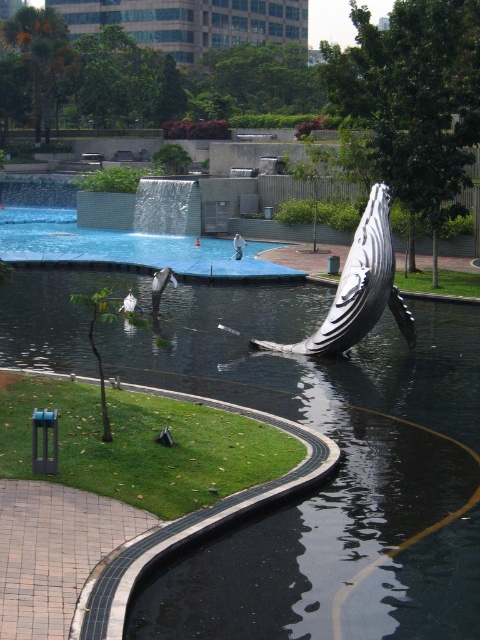
Question: Which object is positioned closest to the blue glossy pond at center?

Choices:
 (A) zebra-striped sculpture at center
 (B) black glossy pool at center

Answer: (B)

Question: Which of the following is the closest to the observer?

Choices:
 (A) zebra-striped sculpture at center
 (B) blue glossy pond at center
 (C) black glossy pool at center

Answer: (C)

Question: Which point appears closest to the camera in this image?

Choices:
 (A) (216, 253)
 (B) (367, 305)

Answer: (B)

Question: Can you confirm if blue glossy pond at center is positioned below zebra-striped sculpture at center?

Choices:
 (A) yes
 (B) no

Answer: (B)

Question: Can you confirm if black glossy pool at center is wider than zebra-striped sculpture at center?

Choices:
 (A) yes
 (B) no

Answer: (A)

Question: Does black glossy pool at center have a smaller size compared to zebra-striped sculpture at center?

Choices:
 (A) yes
 (B) no

Answer: (B)